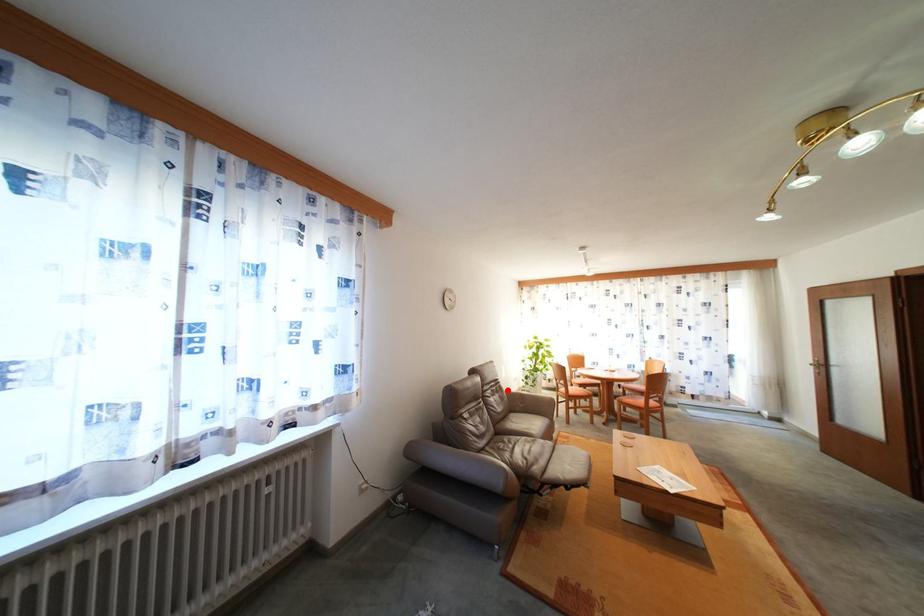
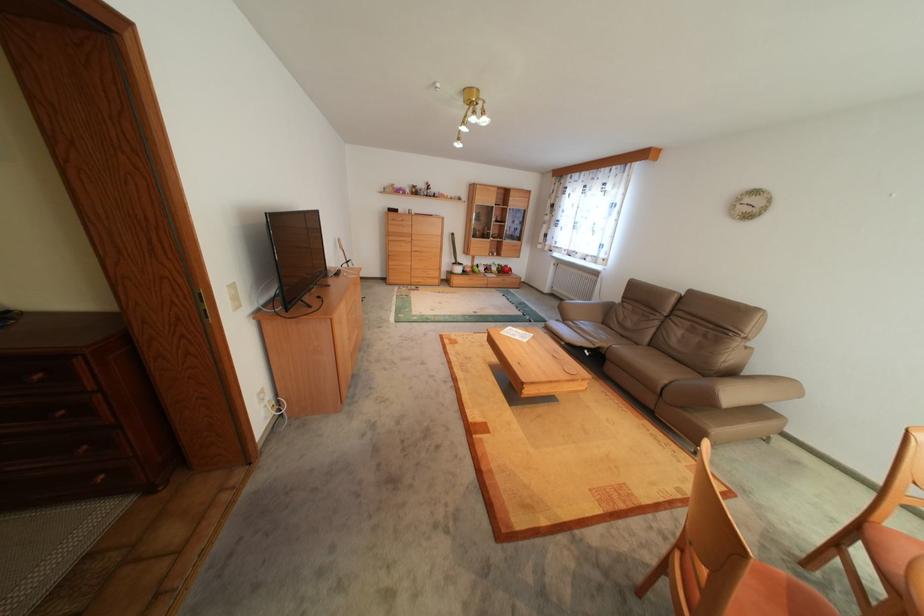
Locate, in the second image, the point that corresponds to the highlighted location in the first image.

(715, 334)